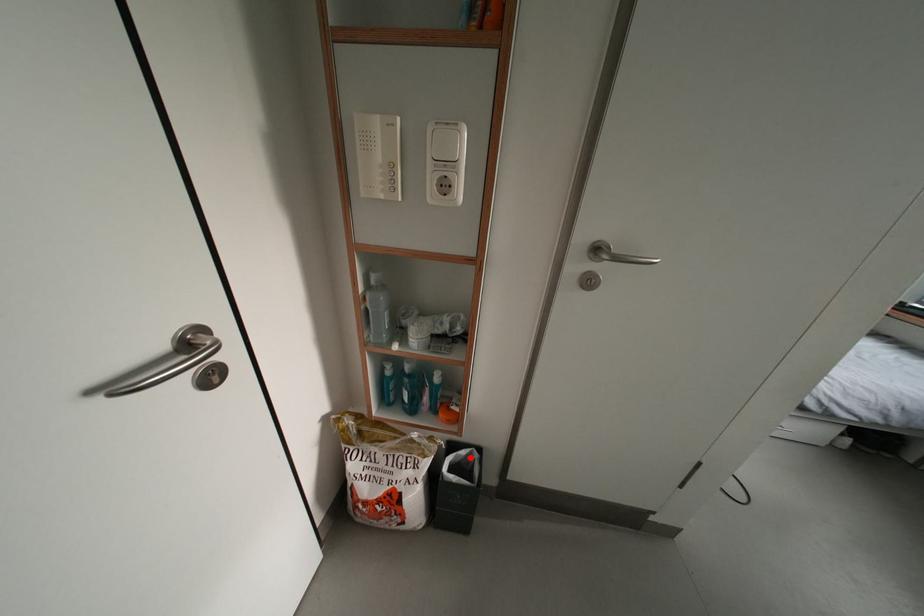
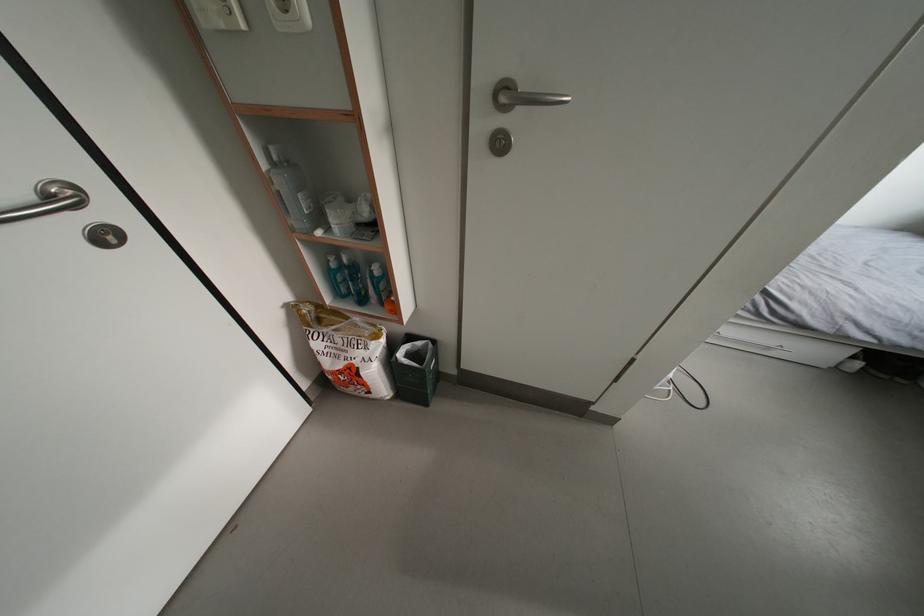
Locate, in the second image, the point that corresponds to the highlighted location in the first image.

(427, 349)